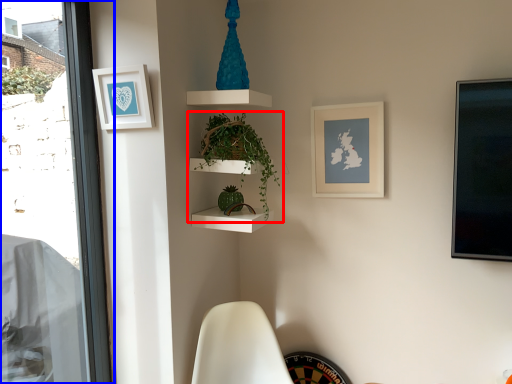
Question: Which object is further to the camera taking this photo, houseplant (highlighted by a red box) or window (highlighted by a blue box)?

Choices:
 (A) houseplant
 (B) window

Answer: (A)